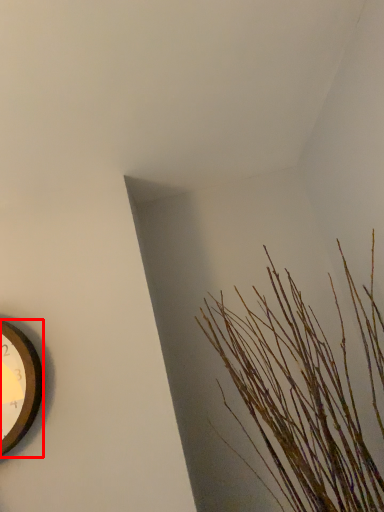
Question: Considering the relative positions of wall clock (annotated by the red box) and houseplant in the image provided, where is wall clock (annotated by the red box) located with respect to the staircase?

Choices:
 (A) right
 (B) left

Answer: (B)